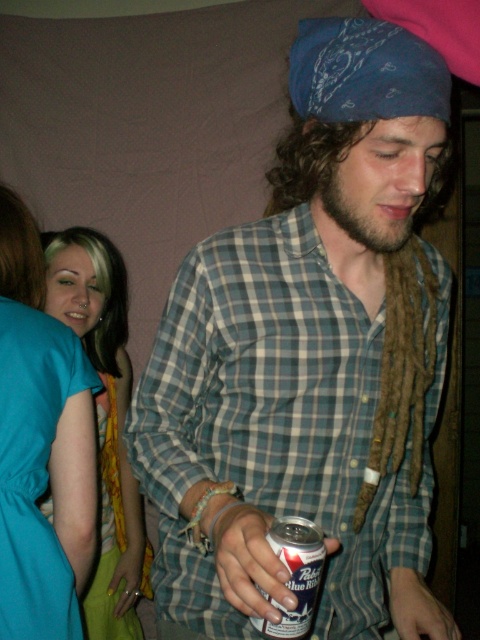
Question: Does teal fabric dress at left appear over silver metallic can at center?

Choices:
 (A) yes
 (B) no

Answer: (B)

Question: Which point is closer to the camera taking this photo?

Choices:
 (A) click(43, 470)
 (B) click(90, 620)
 (C) click(304, 532)

Answer: (C)

Question: Is checkered fabric shirt at center to the right of silver metallic can at center from the viewer's perspective?

Choices:
 (A) yes
 (B) no

Answer: (A)

Question: Does checkered fabric shirt at center have a smaller size compared to teal satin dress at left?

Choices:
 (A) yes
 (B) no

Answer: (B)

Question: Which of the following is the closest to the observer?

Choices:
 (A) (60, 394)
 (B) (46, 304)
 (C) (297, 625)
 (D) (192, 378)

Answer: (C)

Question: Which point is farther to the camera?

Choices:
 (A) (76, 259)
 (B) (287, 541)

Answer: (A)